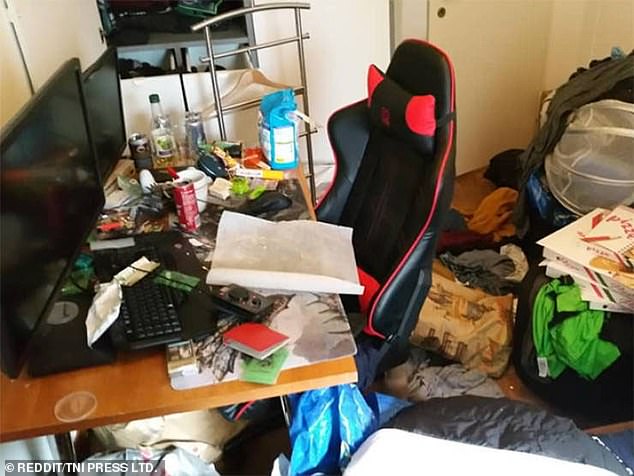
Where is `wall`? wall is located at coordinates (338, 29).